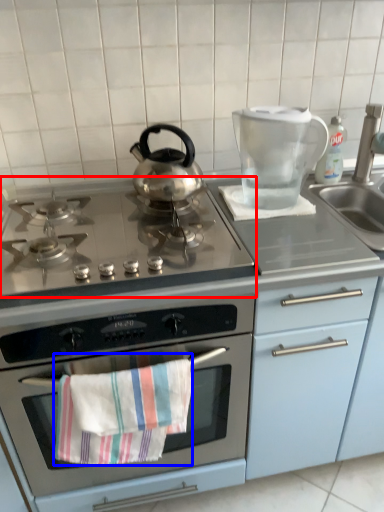
Question: Among these objects, which one is nearest to the camera, gas stove (highlighted by a red box) or beach towel (highlighted by a blue box)?

Choices:
 (A) gas stove
 (B) beach towel

Answer: (A)